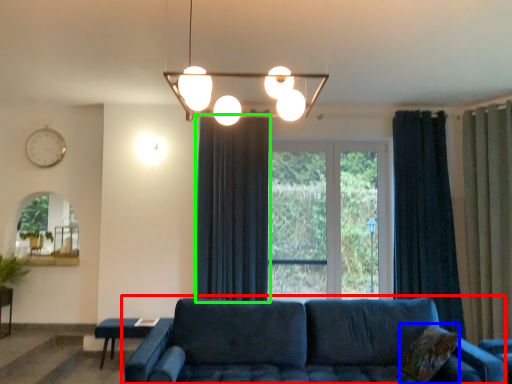
Question: Considering the real-world distances, which object is farthest from studio couch (highlighted by a red box)? pillow (highlighted by a blue box) or curtain (highlighted by a green box)?

Choices:
 (A) pillow
 (B) curtain

Answer: (B)